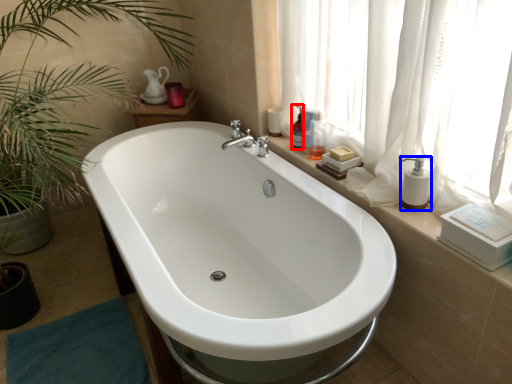
Question: Which point is further to the camera, toiletry (highlighted by a red box) or soap dispenser (highlighted by a blue box)?

Choices:
 (A) toiletry
 (B) soap dispenser

Answer: (A)